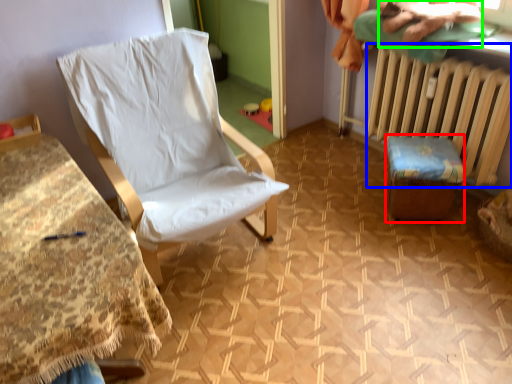
Question: Estimate the real-world distances between objects in this image. Which object is farther from furniture (highlighted by a red box), radiator (highlighted by a blue box) or fabric (highlighted by a green box)?

Choices:
 (A) radiator
 (B) fabric

Answer: (B)